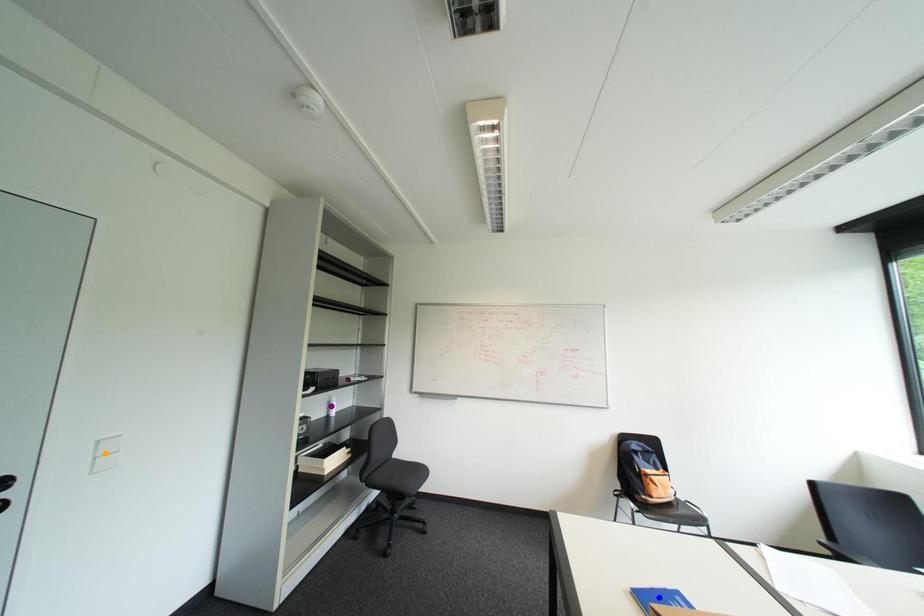
From the picture: Order these from nearest to farthest:
1. orange point
2. blue point
3. purple point

blue point
orange point
purple point